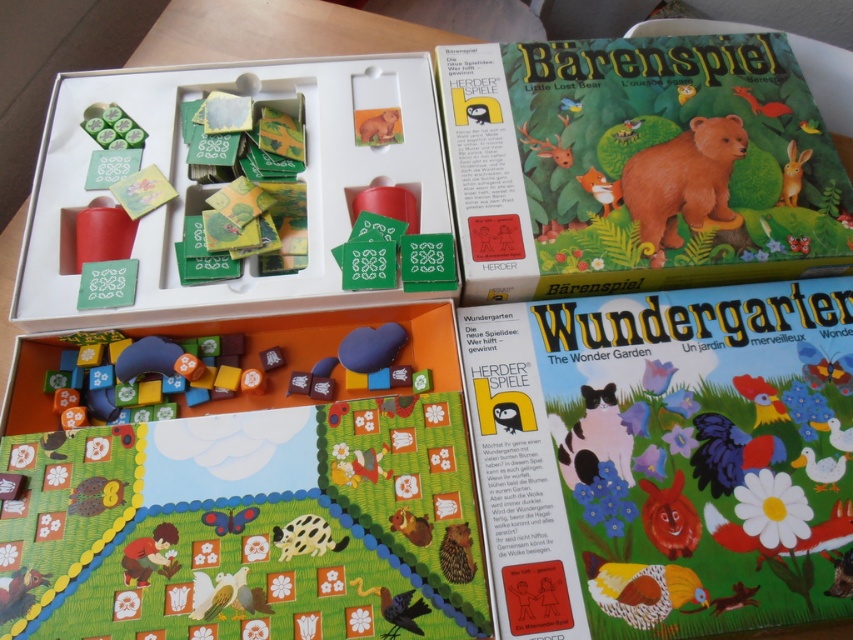
Which of these two, smooth red bear at upper right or brown furry squirrel at center, stands taller?

Standing taller between the two is smooth red bear at upper right.

Between smooth red bear at upper right and brown furry squirrel at center, which one appears on the right side from the viewer's perspective?

smooth red bear at upper right is more to the right.

This screenshot has width=853, height=640. I want to click on smooth red bear at upper right, so click(670, 518).

Can you confirm if wooden board game at center is wider than black and white fur cat at lower center?

Correct, the width of wooden board game at center exceeds that of black and white fur cat at lower center.

Between point (291, 484) and point (624, 465), which one is positioned behind?

Point (624, 465)

This screenshot has width=853, height=640. What do you see at coordinates (242, 497) in the screenshot?
I see `wooden board game at center` at bounding box center [242, 497].

Image resolution: width=853 pixels, height=640 pixels. Find the location of `wooden board game at center`. wooden board game at center is located at coordinates (242, 497).

Identify the location of brown furry hedgehog at lower center. Image resolution: width=853 pixels, height=640 pixels. (456, 554).

Identify the location of brown furry hedgehog at lower center. (456, 554).